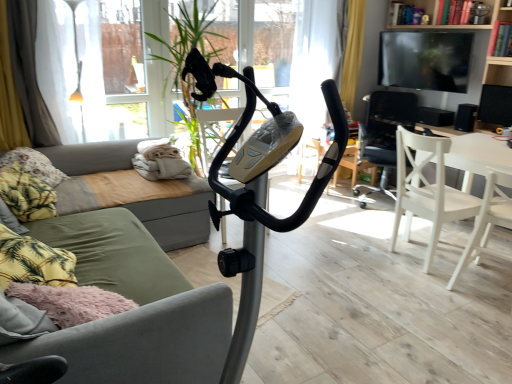
Question: Is wooden bookshelf at upper right at the right side of green fabric couch at center?

Choices:
 (A) yes
 (B) no

Answer: (A)

Question: Considering the relative sizes of wooden bookshelf at upper right and green fabric couch at center in the image provided, is wooden bookshelf at upper right smaller than green fabric couch at center?

Choices:
 (A) no
 (B) yes

Answer: (B)

Question: From a real-world perspective, does wooden bookshelf at upper right stand above green fabric couch at center?

Choices:
 (A) yes
 (B) no

Answer: (A)

Question: Does wooden bookshelf at upper right have a greater height compared to green fabric couch at center?

Choices:
 (A) no
 (B) yes

Answer: (A)

Question: Is wooden bookshelf at upper right closer to camera compared to green fabric couch at center?

Choices:
 (A) no
 (B) yes

Answer: (A)

Question: Looking at their shapes, would you say white wood chair at right, acting as the first chair starting from the front, is wider or thinner than black matte speaker at upper right, the first speaker positioned from the front?

Choices:
 (A) thin
 (B) wide

Answer: (B)

Question: Is white wood chair at right, acting as the first chair starting from the front, bigger or smaller than black matte speaker at upper right, the first speaker positioned from the front?

Choices:
 (A) small
 (B) big

Answer: (B)

Question: Is white wood chair at right, acting as the first chair starting from the front, situated inside black matte speaker at upper right, which ranks as the 3th speaker in back-to-front order, or outside?

Choices:
 (A) inside
 (B) outside

Answer: (B)

Question: Relative to black matte speaker at upper right, the first speaker positioned from the front, is white wood chair at right, acting as the 3th chair starting from the back, in front or behind?

Choices:
 (A) front
 (B) behind

Answer: (A)

Question: Considering the positions of green fabric couch at left and yellow fabric curtain at left in the image, is green fabric couch at left wider or thinner than yellow fabric curtain at left?

Choices:
 (A) thin
 (B) wide

Answer: (B)

Question: From their relative heights in the image, would you say green fabric couch at left is taller or shorter than yellow fabric curtain at left?

Choices:
 (A) tall
 (B) short

Answer: (B)

Question: Considering the positions of point (95, 152) and point (12, 39), is point (95, 152) closer or farther from the camera than point (12, 39)?

Choices:
 (A) closer
 (B) farther

Answer: (B)

Question: Looking at the image, does green fabric couch at left seem bigger or smaller compared to yellow fabric curtain at left?

Choices:
 (A) small
 (B) big

Answer: (B)

Question: Is white wood chair at center right, marked as the third chair in a front-to-back arrangement, taller or shorter than green fabric couch at center?

Choices:
 (A) short
 (B) tall

Answer: (B)

Question: In the image, is white wood chair at center right, marked as the third chair in a front-to-back arrangement, on the left side or the right side of green fabric couch at center?

Choices:
 (A) right
 (B) left

Answer: (A)